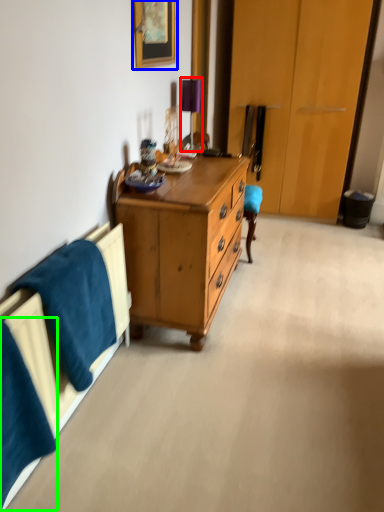
Question: Which object is positioned farthest from table lamp (highlighted by a red box)? Select from picture frame (highlighted by a blue box) and blanket (highlighted by a green box).

Choices:
 (A) picture frame
 (B) blanket

Answer: (B)